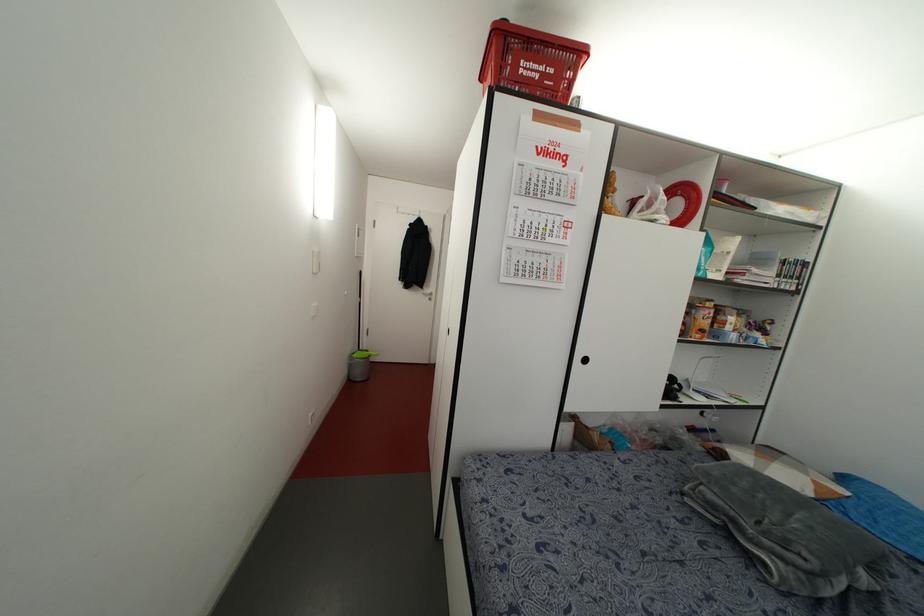
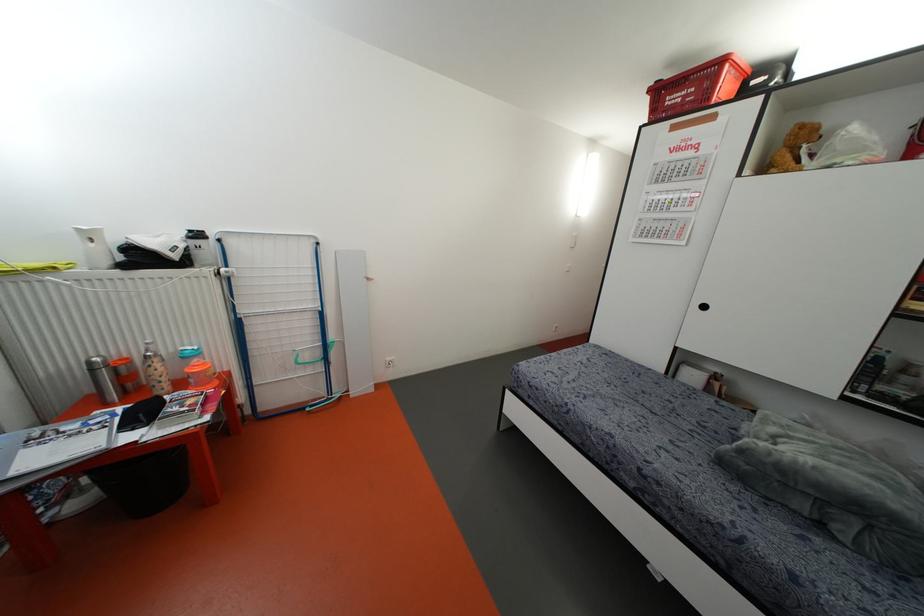
Locate, in the second image, the point that corresponds to pixel 585 360 in the first image.

(703, 307)